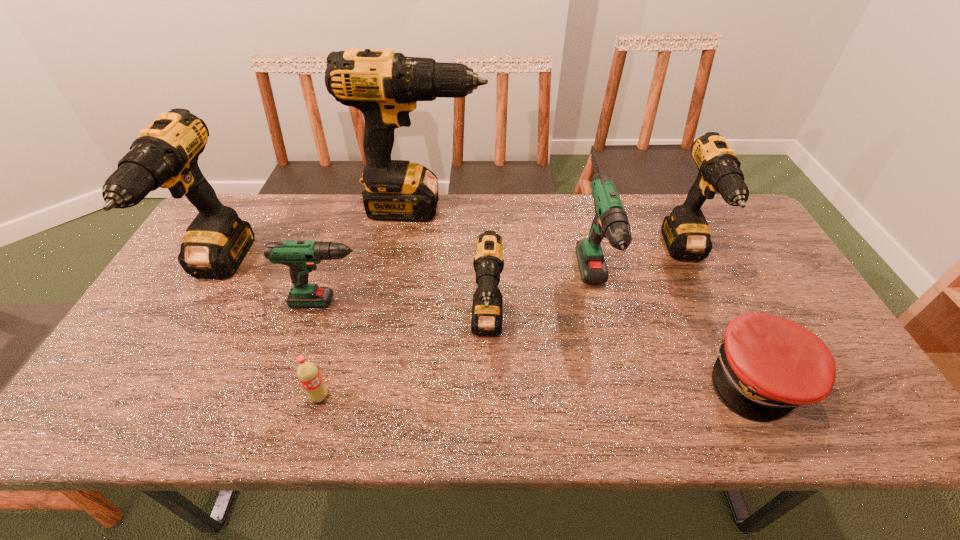
You are a GUI agent. You are given a task and a screenshot of the screen. Output one action in this format:
    pyautogui.click(x=<x>, y=<y>)
    Task: Click on the free point that satisfies the following two spatial constraints: 1. on the handle side of the shortest drill; 2. on the back side of the red soda
    
    Given the screenshot: What is the action you would take?
    pyautogui.click(x=308, y=396)